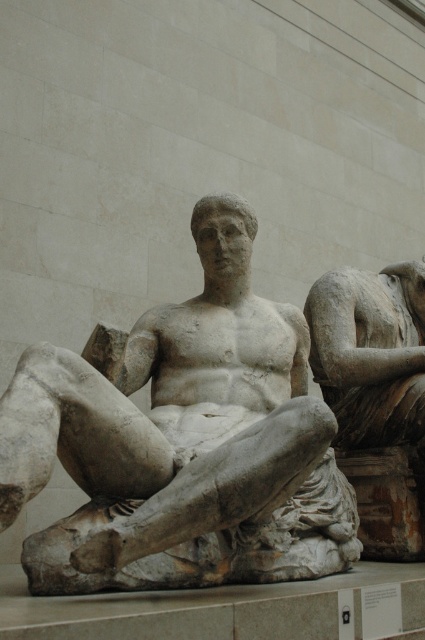
You are an art conservator standing at the entrance of the gallery. You need to move a protective barrier around the white marble statue at center to ensure it is visible from all angles. Based on its current position, which direction should you move the barrier to allow viewers to see the statue from the front?

The white marble statue at center is located at point (183, 440), so moving the barrier to the left would allow viewers to see the statue from the front.

You are an art conservator examining the classical marble sculpture. You notice two figures in the scene. Which figure is positioned lower in the image, the white marble statue at center or the matte stone reclining figure at center?

The white marble statue at center is located below the matte stone reclining figure at center, so the white marble statue at center is positioned lower in the image.

You are an art conservator examining the image. You notice two figures in the center. Which one is closer to you, the white marble statue at center or the matte stone reclining figure at center?

The white marble statue at center is closer to you because it is in front of the matte stone reclining figure at center.